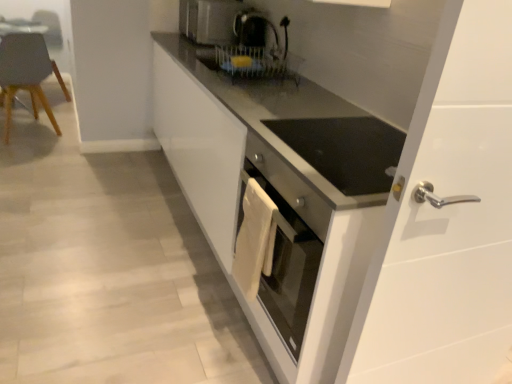
Question: Considering the relative sizes of matte gray chair at left and white glossy cabinet at center in the image provided, is matte gray chair at left bigger than white glossy cabinet at center?

Choices:
 (A) yes
 (B) no

Answer: (B)

Question: Can you confirm if matte gray chair at left is smaller than white glossy cabinet at center?

Choices:
 (A) no
 (B) yes

Answer: (B)

Question: Does matte gray chair at left have a greater height compared to white glossy cabinet at center?

Choices:
 (A) yes
 (B) no

Answer: (B)

Question: From the image's perspective, is matte gray chair at left below white glossy cabinet at center?

Choices:
 (A) no
 (B) yes

Answer: (A)

Question: Is matte gray chair at left not near white glossy cabinet at center?

Choices:
 (A) no
 (B) yes

Answer: (B)

Question: Is matte gray chair at left not within white glossy cabinet at center?

Choices:
 (A) yes
 (B) no

Answer: (A)

Question: Is white glossy cabinet at center not within black glossy coffee machine at upper center?

Choices:
 (A) no
 (B) yes

Answer: (B)

Question: Is black glossy coffee machine at upper center a part of white glossy cabinet at center?

Choices:
 (A) yes
 (B) no

Answer: (B)

Question: Considering the relative positions of white glossy cabinet at center and black glossy coffee machine at upper center in the image provided, is white glossy cabinet at center to the left of black glossy coffee machine at upper center from the viewer's perspective?

Choices:
 (A) yes
 (B) no

Answer: (A)

Question: Considering the relative sizes of white glossy cabinet at center and black glossy coffee machine at upper center in the image provided, is white glossy cabinet at center thinner than black glossy coffee machine at upper center?

Choices:
 (A) no
 (B) yes

Answer: (A)

Question: Is white glossy cabinet at center with black glossy coffee machine at upper center?

Choices:
 (A) yes
 (B) no

Answer: (B)

Question: Considering the relative positions of white glossy cabinet at center and black glossy coffee machine at upper center in the image provided, is white glossy cabinet at center behind black glossy coffee machine at upper center?

Choices:
 (A) no
 (B) yes

Answer: (A)

Question: Can you confirm if black glossy coffee machine at upper center is shorter than matte gray chair at left?

Choices:
 (A) no
 (B) yes

Answer: (B)